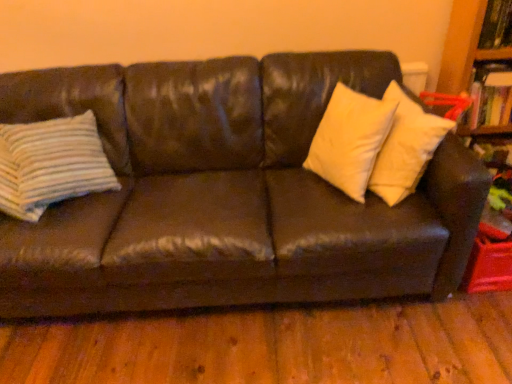
Question: From a real-world perspective, relative to leather couch at center, is hardcover book at upper right vertically above or below?

Choices:
 (A) below
 (B) above

Answer: (B)

Question: From the image's perspective, is hardcover book at upper right located above or below leather couch at center?

Choices:
 (A) above
 (B) below

Answer: (A)

Question: Estimate the real-world distances between objects in this image. Which object is farther from the hardcover book at upper right?

Choices:
 (A) wooden bookcase at upper right
 (B) leather couch at center
 (C) white matte pillow at upper right, marked as the second pillow in a left-to-right arrangement
 (D) striped fabric pillow at left, the second pillow in the right-to-left sequence

Answer: (D)

Question: Which object is positioned farthest from the hardcover book at upper right?

Choices:
 (A) white matte pillow at upper right, marked as the second pillow in a left-to-right arrangement
 (B) wooden bookcase at upper right
 (C) leather couch at center
 (D) striped fabric pillow at left, placed as the first pillow when sorted from left to right

Answer: (D)